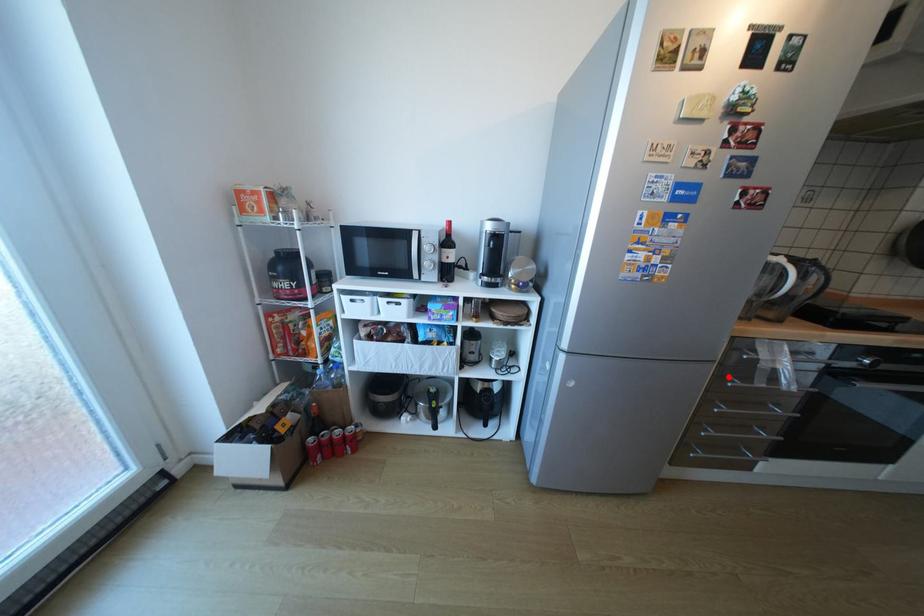
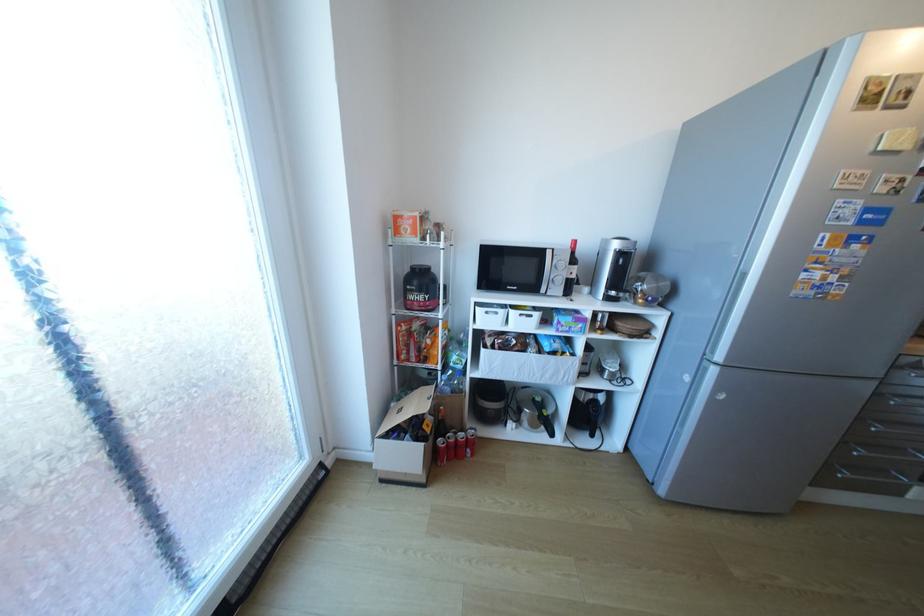
Locate, in the second image, the point that corresponds to the highlighted location in the first image.

(886, 395)